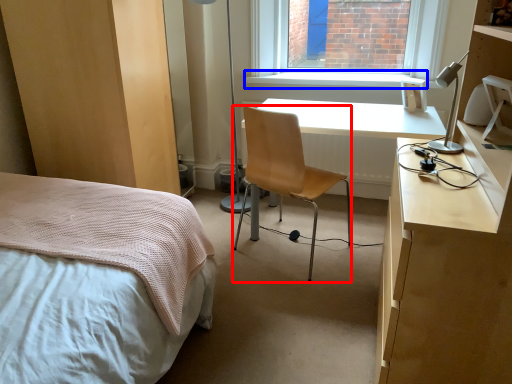
Question: Among these objects, which one is nearest to the camera, chair (highlighted by a red box) or window sill (highlighted by a blue box)?

Choices:
 (A) chair
 (B) window sill

Answer: (A)